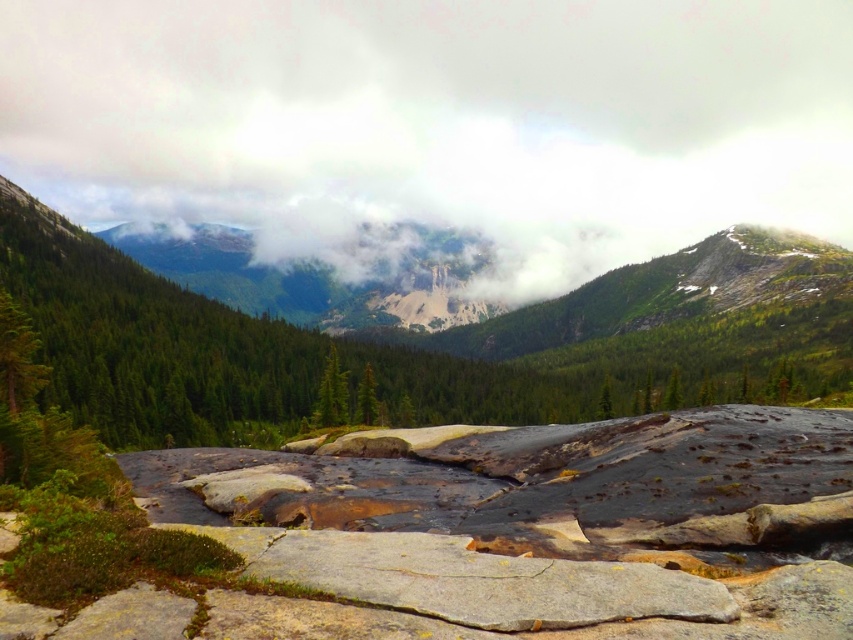
Question: Does white fluffy cloud at upper center lie behind green matte tree at center?

Choices:
 (A) no
 (B) yes

Answer: (B)

Question: Which point is closer to the camera?

Choices:
 (A) (68, 406)
 (B) (488, 132)

Answer: (A)

Question: Which point appears farthest from the camera in this image?

Choices:
 (A) (502, 397)
 (B) (161, 99)

Answer: (B)

Question: Does white fluffy cloud at upper center come in front of green matte tree at center?

Choices:
 (A) yes
 (B) no

Answer: (B)

Question: Which object is closer to the camera taking this photo?

Choices:
 (A) white fluffy cloud at upper center
 (B) green matte tree at center

Answer: (B)

Question: Is white fluffy cloud at upper center above green matte tree at center?

Choices:
 (A) yes
 (B) no

Answer: (A)